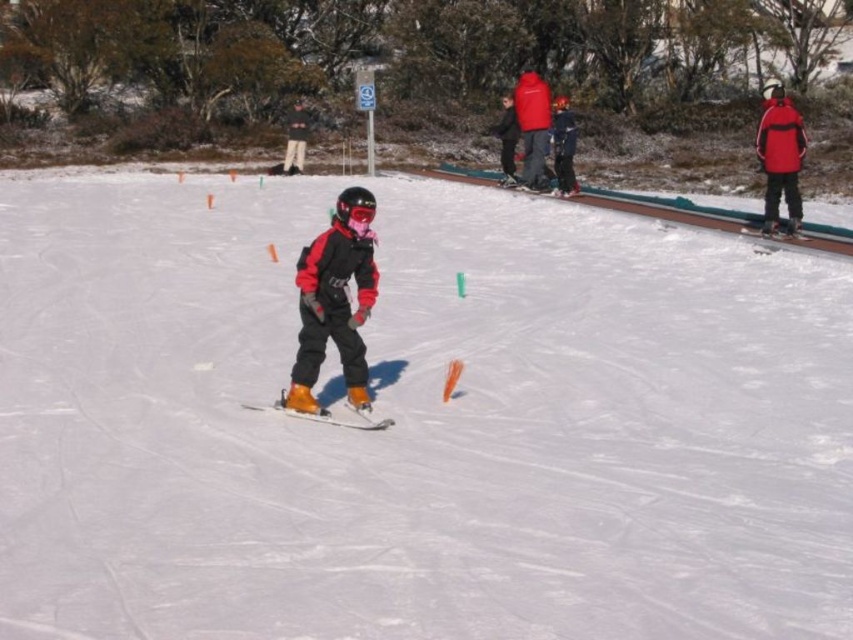
Is red matte jacket at upper right taller than matte black jacket at center?

Indeed, red matte jacket at upper right has a greater height compared to matte black jacket at center.

The width and height of the screenshot is (853, 640). What do you see at coordinates (780, 156) in the screenshot?
I see `red matte jacket at upper right` at bounding box center [780, 156].

Locate an element on the screen. This screenshot has height=640, width=853. red matte jacket at upper right is located at coordinates (780, 156).

This screenshot has height=640, width=853. What are the coordinates of `red matte jacket at upper right` in the screenshot? It's located at (780, 156).

Can you confirm if matte black snowboard at center is bigger than matte black jacket at center?

Incorrect, matte black snowboard at center is not larger than matte black jacket at center.

Does point (349, 326) lie in front of point (553, 108)?

Yes, point (349, 326) is in front of point (553, 108).

Describe the element at coordinates (335, 300) in the screenshot. I see `matte black snowboard at center` at that location.

This screenshot has height=640, width=853. Identify the location of matte black snowboard at center. 335,300.

Between orange matte ski at center and matte black jacket at upper center, which one appears on the right side from the viewer's perspective?

From the viewer's perspective, matte black jacket at upper center appears more on the right side.

Between orange matte ski at center and matte black jacket at upper center, which one has more height?

Standing taller between the two is matte black jacket at upper center.

Between point (318, 416) and point (500, 141), which one is positioned in front?

Point (318, 416) is more forward.

Where is `orange matte ski at center`? This screenshot has width=853, height=640. orange matte ski at center is located at coordinates (328, 413).